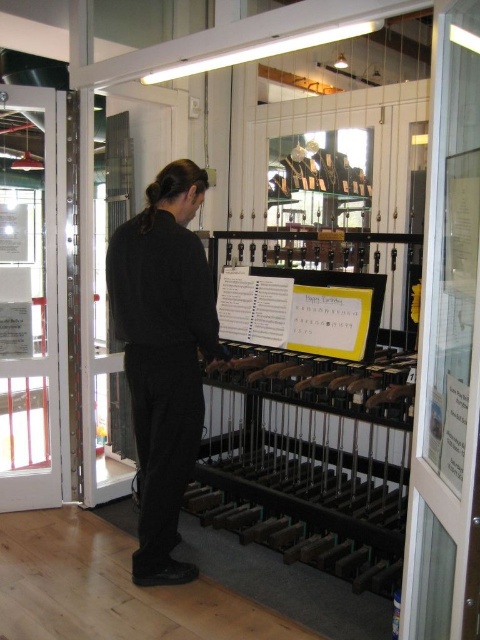
You are standing in a music shop and see two points marked on the floor. The first point is at coordinate point (448, 336) and the second is at point (279, 289). Which point is closer to you?

Point (448, 336) is closer to the viewer than point (279, 289).

You are a customer in the music shop and want to read the yellow paper at center. Can you easily access it without moving the black matte pants at center?

The black matte pants at center is in front of the yellow paper at center, so you cannot easily access the yellow paper at center without moving the black matte pants at center.

You are a customer entering the music shop and see the transparent glass door at right and the yellow paper at center. Which object is nearer to you as you walk through the entrance?

The transparent glass door at right is closer to the viewer than the yellow paper at center, so the transparent glass door at right is nearer to you as you walk through the entrance.